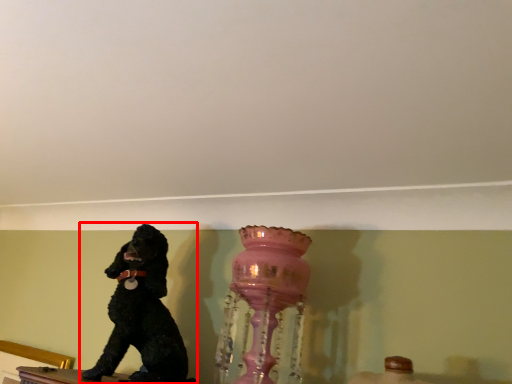
Question: From the image, what is the correct spatial relationship of dog (annotated by the red box) in relation to vase?

Choices:
 (A) left
 (B) right

Answer: (A)